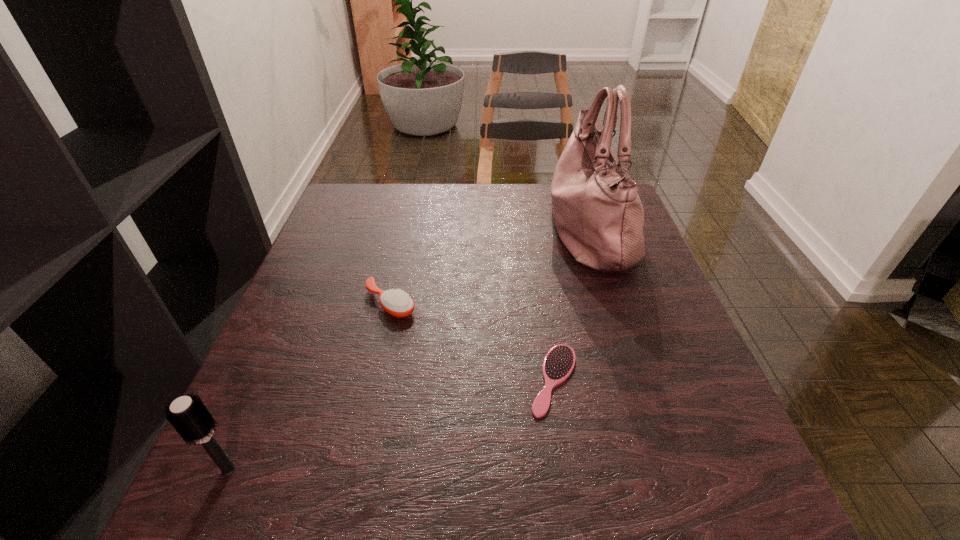
Find the location of `vacant space at the far edge`. vacant space at the far edge is located at coordinates (401, 187).

Where is `blank area at the near edge`? blank area at the near edge is located at coordinates (436, 526).

Find the location of `free space at the left edge of the desktop`. free space at the left edge of the desktop is located at coordinates (291, 327).

I want to click on vacant space at the right edge, so click(654, 264).

The width and height of the screenshot is (960, 540). I want to click on free spot between the tallest object and the second hairbrush from right to left, so click(490, 267).

At what (x,y) coordinates should I click in order to perform the action: click on unoccupied position between the handbag and the rightmost hairbrush. Please return your answer as a coordinate pair (x, y). The width and height of the screenshot is (960, 540). Looking at the image, I should click on (571, 305).

Locate an element on the screen. This screenshot has width=960, height=540. free area in between the farthest object and the second hairbrush from left to right is located at coordinates (490, 267).

Find the location of a particular element. The height and width of the screenshot is (540, 960). unoccupied area between the farthest object and the second nearest object is located at coordinates (571, 305).

In order to click on empty location between the second shortest hairbrush and the nearest object in this screenshot , I will do `click(310, 386)`.

The image size is (960, 540). What are the coordinates of `free spot between the rightmost hairbrush and the third object from right to left` in the screenshot? It's located at (472, 341).